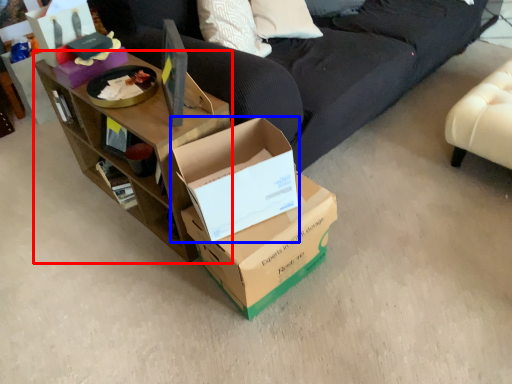
Question: Which of the following is the closest to the observer, shelf (highlighted by a red box) or box (highlighted by a blue box)?

Choices:
 (A) shelf
 (B) box

Answer: (B)